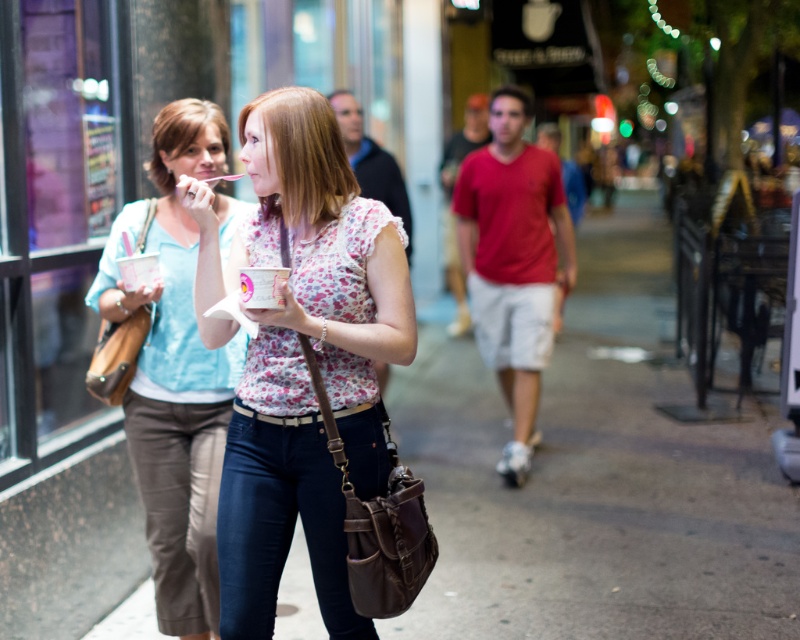
Question: Is floral fabric shirt at center to the left of matte pink ice cream cup at center from the viewer's perspective?

Choices:
 (A) yes
 (B) no

Answer: (B)

Question: Is matte brown bag at center to the right of floral fabric shirt at center from the viewer's perspective?

Choices:
 (A) no
 (B) yes

Answer: (B)

Question: Which of the following is the closest to the observer?

Choices:
 (A) (229, 636)
 (B) (334, 605)
 (C) (492, 525)

Answer: (A)

Question: Which of these objects is positioned farthest from the floral fabric shirt at center?

Choices:
 (A) matte pink ice cream cup at center
 (B) dark blue denim jeans at center

Answer: (A)

Question: Considering the relative positions of matte brown bag at center and dark blue denim jeans at center in the image provided, where is matte brown bag at center located with respect to dark blue denim jeans at center?

Choices:
 (A) above
 (B) below

Answer: (A)

Question: Which object is closer to the camera taking this photo?

Choices:
 (A) floral fabric shirt at center
 (B) matte pink ice cream cup at center
 (C) matte brown bag at center
 (D) dark blue denim jeans at center

Answer: (A)